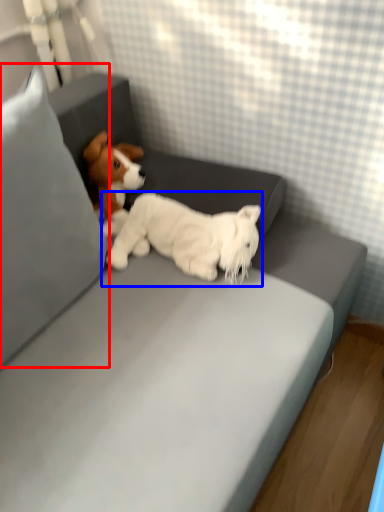
Question: Which object is further to the camera taking this photo, pillow (highlighted by a red box) or dog (highlighted by a blue box)?

Choices:
 (A) pillow
 (B) dog

Answer: (B)